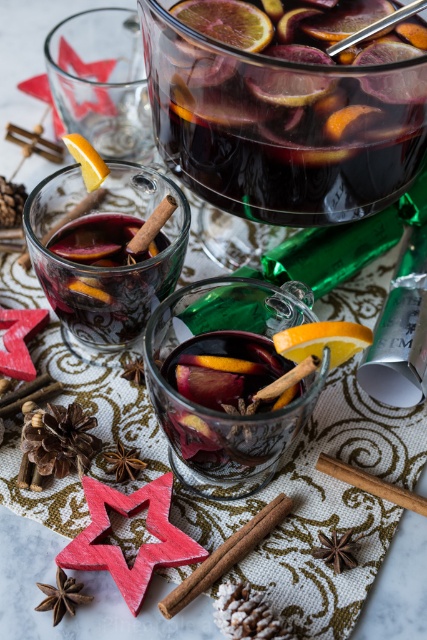
Between point (363, 332) and point (87, 145), which one is positioned behind?

The point (87, 145) is more distant.

Is orangesmoothslice at center below yellow matte orange at center?

Yes, orangesmoothslice at center is below yellow matte orange at center.

Identify the location of orangesmoothslice at center. (322, 340).

Who is more forward, (324, 96) or (102, 161)?

Point (324, 96) is in front.

Describe the element at coordinates (278, 125) in the screenshot. I see `dark red glass at upper center` at that location.

Which is in front, point (260, 138) or point (99, 157)?

Point (260, 138) is more forward.

This screenshot has height=640, width=427. What are the coordinates of `dark red glass at upper center` in the screenshot? It's located at [x=278, y=125].

Between dark red glass at upper center and orangesmoothorange slice at upper center, which one has more height?

dark red glass at upper center

Can you confirm if dark red glass at upper center is positioned above orangesmoothorange slice at upper center?

Yes.

Identify the location of dark red glass at upper center. (278, 125).

Locate an element on the screen. dark red glass at upper center is located at coordinates (278, 125).